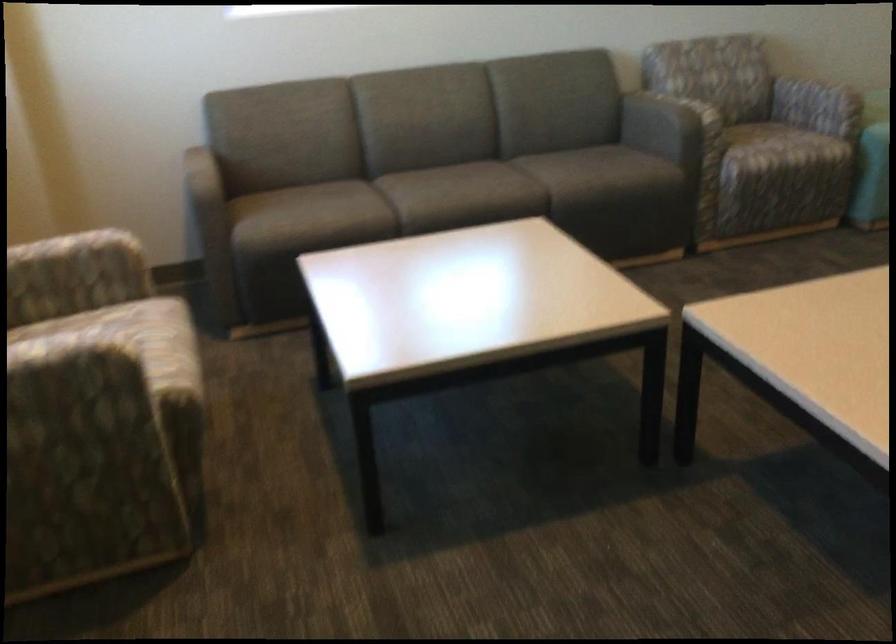
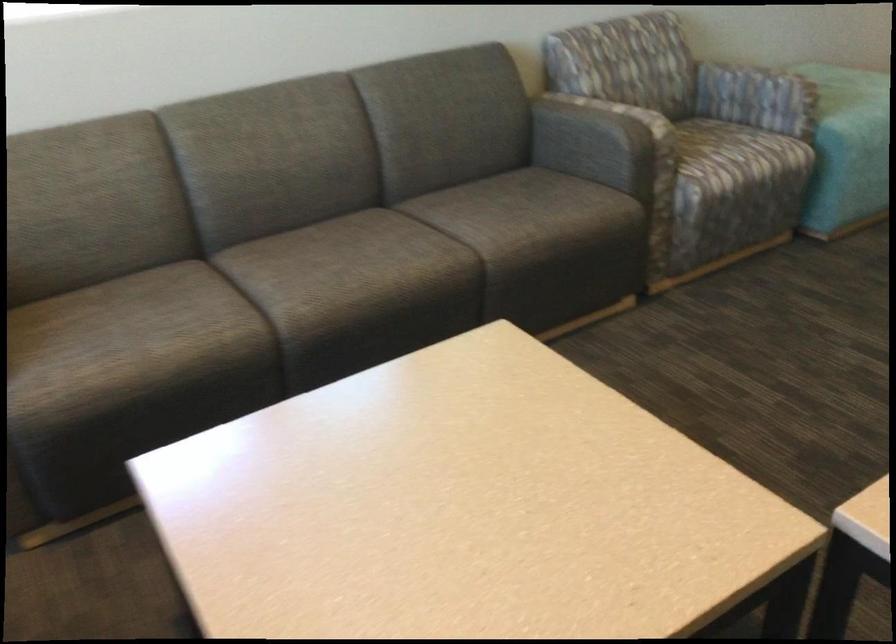
In the second image, find the point that corresponds to [657,122] in the first image.

(597, 140)